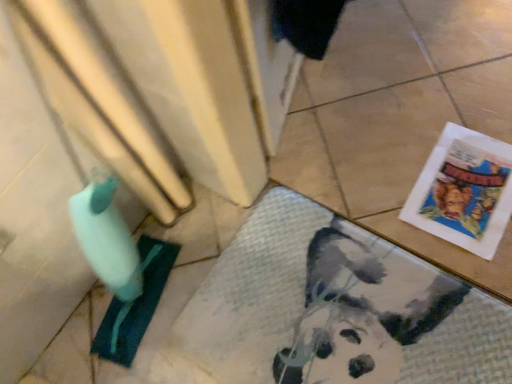
Where is `free space above white paper comic book at lower right (from a real-world perspective)`? The height and width of the screenshot is (384, 512). free space above white paper comic book at lower right (from a real-world perspective) is located at coordinates point(470,185).